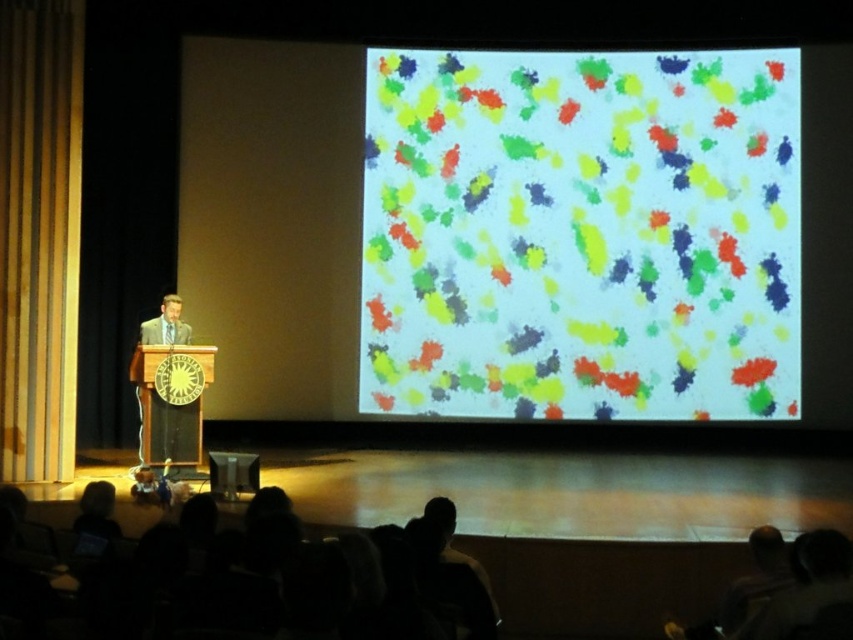
Question: Is colorful paint splatters at center to the right of wooden at left from the viewer's perspective?

Choices:
 (A) yes
 (B) no

Answer: (A)

Question: Among these objects, which one is nearest to the camera?

Choices:
 (A) wooden at left
 (B) dark hair at lower center

Answer: (B)

Question: Which of these objects is positioned farthest from the wooden at left?

Choices:
 (A) colorful paint splatters at center
 (B) dark hair at lower center

Answer: (B)

Question: Can you confirm if colorful paint splatters at center is positioned to the right of dark hair at lower center?

Choices:
 (A) no
 (B) yes

Answer: (B)

Question: Is colorful paint splatters at center smaller than wooden at left?

Choices:
 (A) no
 (B) yes

Answer: (B)

Question: Which of the following is the farthest from the observer?

Choices:
 (A) wooden at left
 (B) dark hair at lower center
 (C) colorful paint splatters at center

Answer: (C)